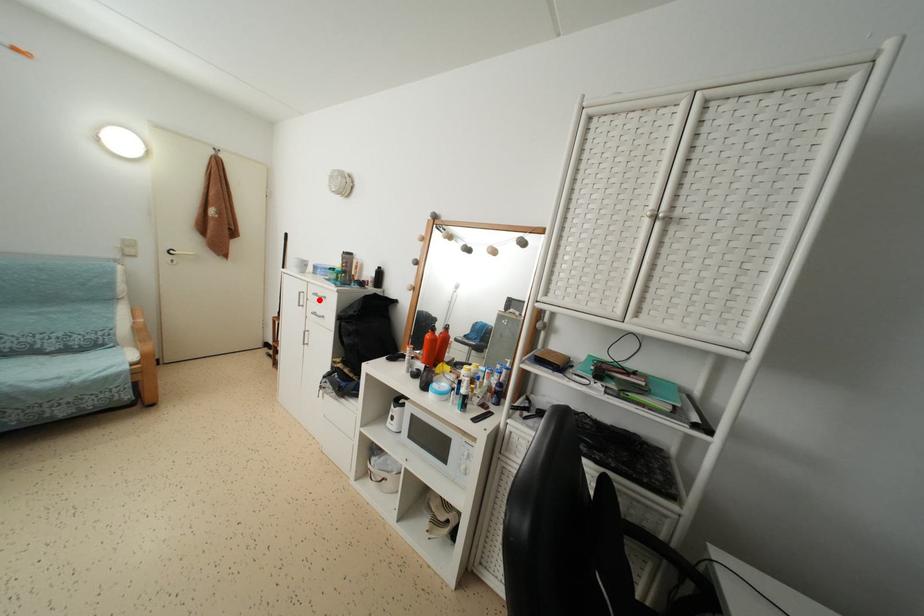
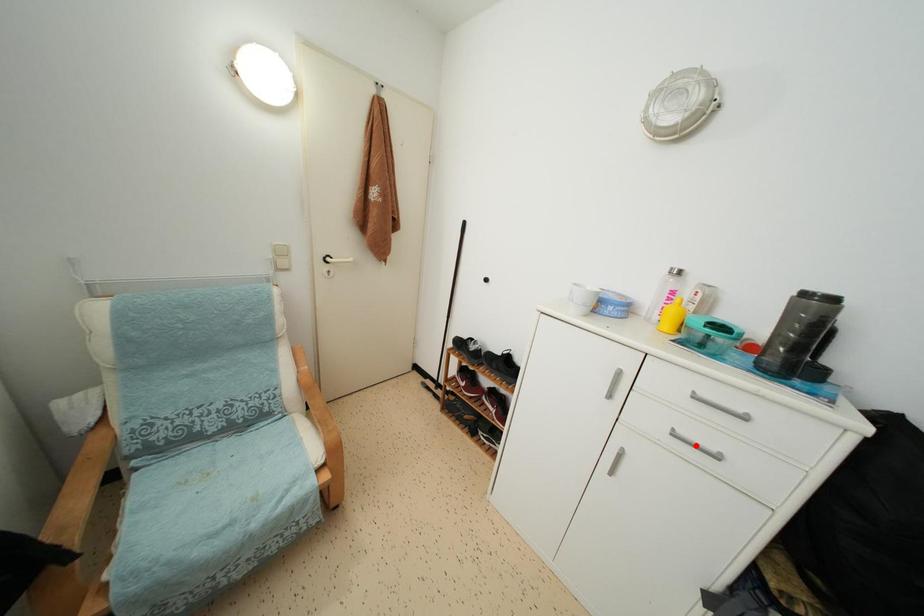
I am providing you with two images of the same scene from different viewpoints. A red point is marked on the first image and another point is marked on the second image. Do the highlighted points in image1 and image2 indicate the same real-world spot?

No